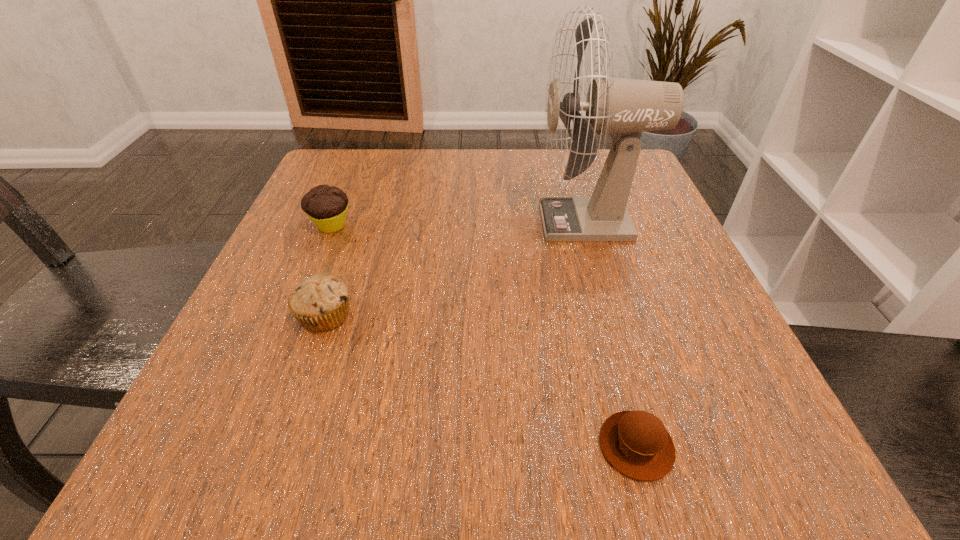
Where is `vacant area between the farthest muffin and the tallest object`? Image resolution: width=960 pixels, height=540 pixels. vacant area between the farthest muffin and the tallest object is located at coordinates (461, 224).

This screenshot has width=960, height=540. I want to click on free space between the nearest object and the third farthest object, so click(481, 381).

Identify the location of vacant area that lies between the farthest muffin and the second farthest muffin. (328, 271).

The width and height of the screenshot is (960, 540). I want to click on free space between the fan and the farthest muffin, so click(x=461, y=224).

Locate which object ranks second in proximity to the third farthest object. Please provide its 2D coordinates. Your answer should be formatted as a tuple, i.e. [(x, y)], where the tuple contains the x and y coordinates of a point satisfying the conditions above.

[(625, 107)]

The height and width of the screenshot is (540, 960). What are the coordinates of `object that is the second closest to the tallest object` in the screenshot? It's located at (320, 302).

Choose which muffin is the third nearest neighbor to the tallest object. Please provide its 2D coordinates. Your answer should be formatted as a tuple, i.e. [(x, y)], where the tuple contains the x and y coordinates of a point satisfying the conditions above.

[(326, 206)]

Choose which muffin is the second nearest neighbor to the second nearest object. Please provide its 2D coordinates. Your answer should be formatted as a tuple, i.e. [(x, y)], where the tuple contains the x and y coordinates of a point satisfying the conditions above.

[(636, 443)]

At what (x,y) coordinates should I click in order to perform the action: click on vacant space that satisfies the following two spatial constraints: 1. on the front side of the third farthest object; 2. on the left side of the shortest object. Please return your answer as a coordinate pair (x, y). Looking at the image, I should click on (280, 446).

Where is `vacant space that satisfies the following two spatial constraints: 1. on the air flow direction of the fan; 2. on the front side of the farthest muffin`? vacant space that satisfies the following two spatial constraints: 1. on the air flow direction of the fan; 2. on the front side of the farthest muffin is located at coordinates (590, 226).